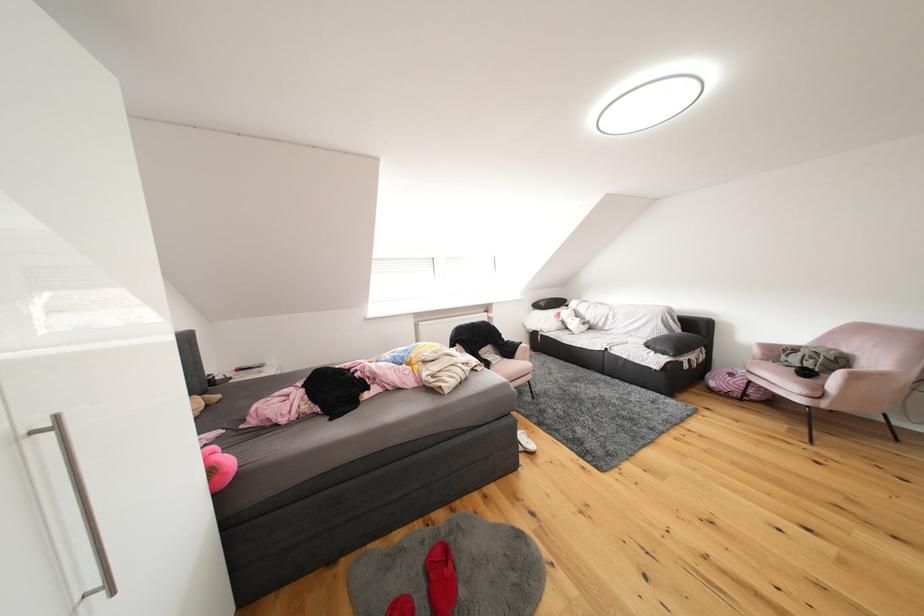
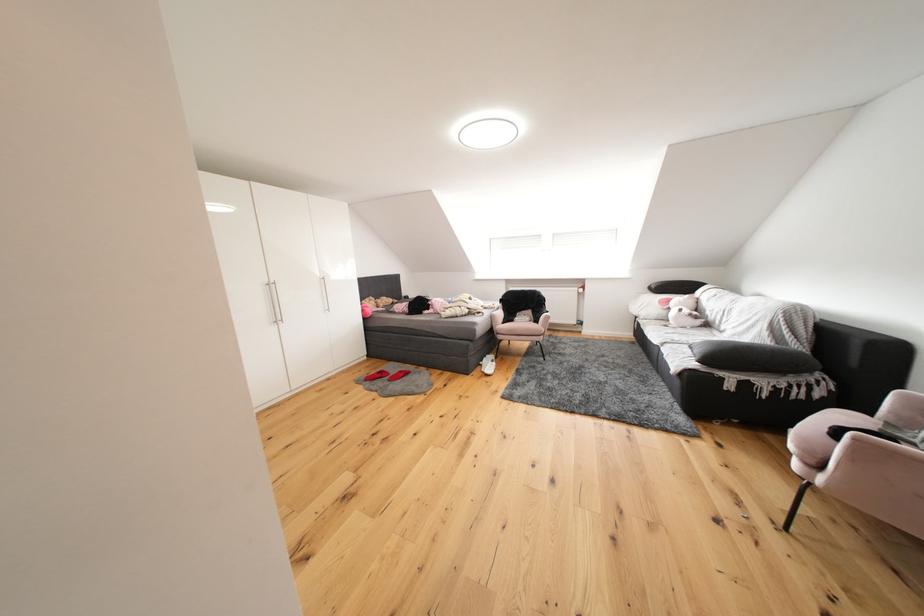
Locate, in the second image, the point that corresponds to pixel 568 318 in the first image.

(677, 305)